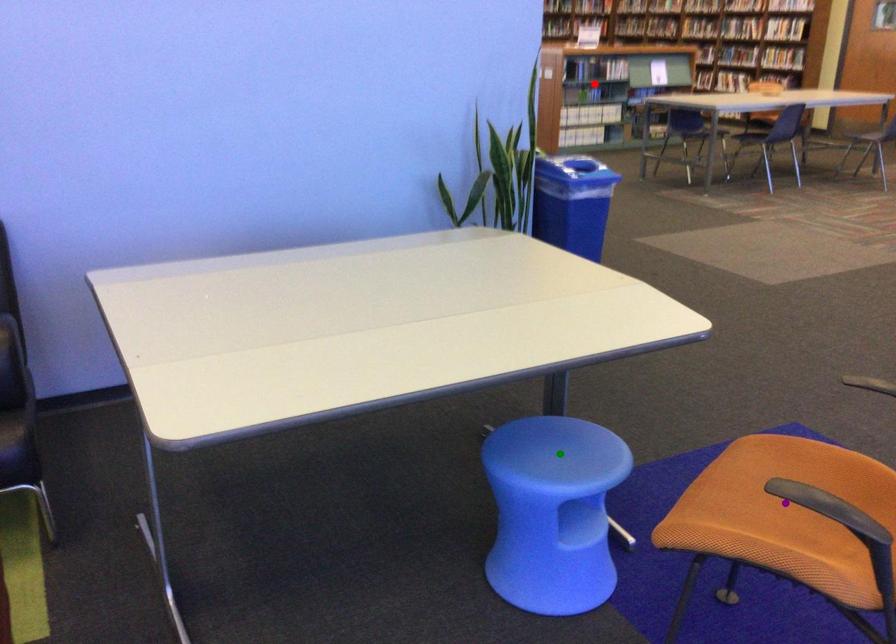
Order these from nearest to farthest:
1. red point
2. purple point
3. green point

1. purple point
2. green point
3. red point